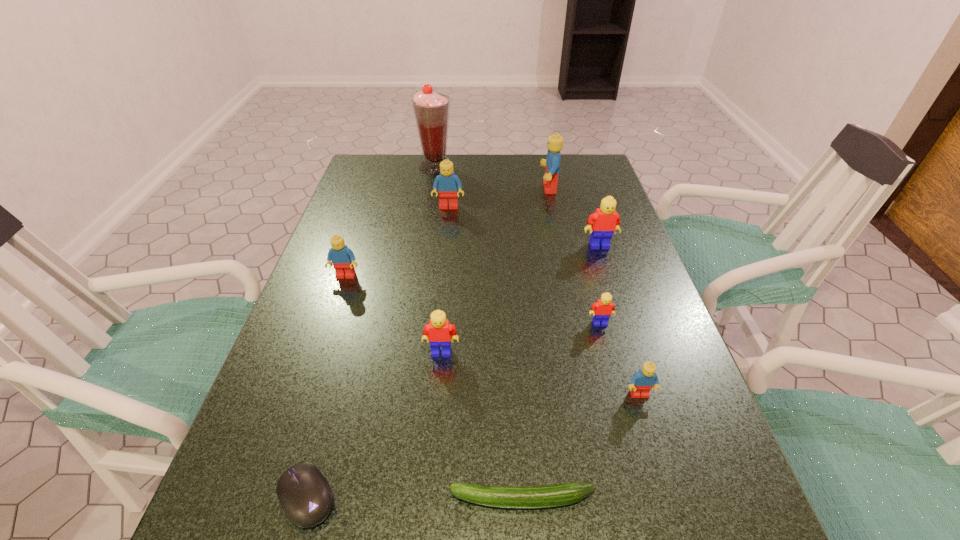
Locate an element on the screen. The image size is (960, 540). the second biggest yellow Lego is located at coordinates (438, 332).

Find the location of a particular element. the second nearest Lego is located at coordinates (438, 332).

Find the location of a particular element. the fifth farthest Lego is located at coordinates (602, 310).

You are a GUI agent. You are given a task and a screenshot of the screen. Output one action in this format:
    pyautogui.click(x=<x>, y=<y>)
    Task: Click on the second nearest yellow Lego
    
    Given the screenshot: What is the action you would take?
    pyautogui.click(x=602, y=310)

Identify the location of the smallest blue Lego. (642, 382).

Find the location of a particular element. the nearest blue Lego is located at coordinates (642, 382).

Identify the location of the second shortest object. This screenshot has width=960, height=540. (305, 495).

Where is `computer mouse`? This screenshot has width=960, height=540. computer mouse is located at coordinates (305, 495).

The height and width of the screenshot is (540, 960). Identify the location of the shortest object. (562, 494).

I want to click on vacant area situated on the front of the red smoothie, so click(x=429, y=209).